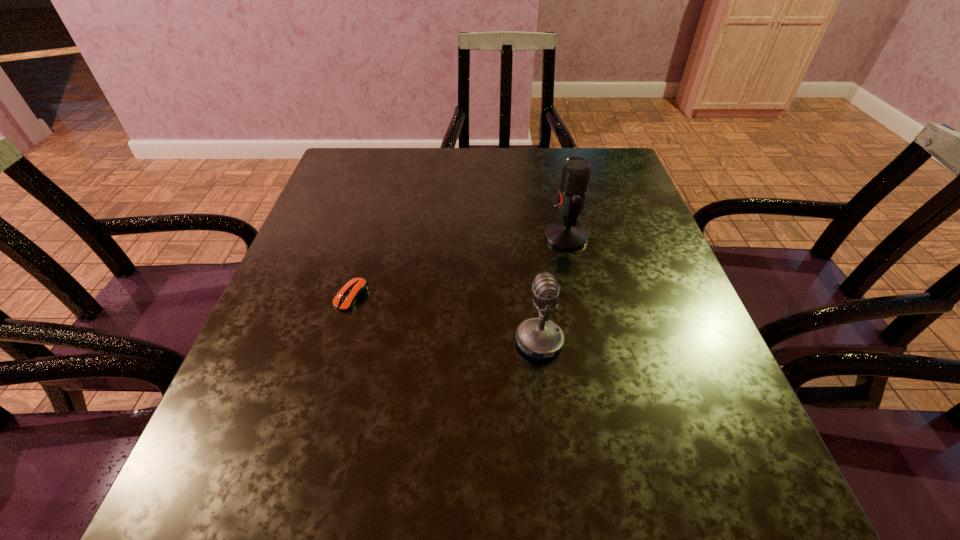
Find the location of a particular element. free spot between the nearer microphone and the computer mouse is located at coordinates (445, 319).

The height and width of the screenshot is (540, 960). What are the coordinates of `empty space that is in between the computer mouse and the farther microphone` in the screenshot? It's located at (459, 267).

What are the coordinates of `vacant region between the shortest object and the farther microphone` in the screenshot? It's located at (459, 267).

The width and height of the screenshot is (960, 540). In order to click on free space between the computer mouse and the farther microphone in this screenshot , I will do `click(459, 267)`.

Locate which object is the second closest to the second shortest object. Please provide its 2D coordinates. Your answer should be formatted as a tuple, i.e. [(x, y)], where the tuple contains the x and y coordinates of a point satisfying the conditions above.

[(356, 288)]

Select which object appears as the second closest to the shortest object. Please provide its 2D coordinates. Your answer should be formatted as a tuple, i.e. [(x, y)], where the tuple contains the x and y coordinates of a point satisfying the conditions above.

[(568, 235)]

Identify the location of vacant space that satisfies the following two spatial constraints: 1. on the side of the farthest object with the red ring; 2. on the front side of the shortest object. The height and width of the screenshot is (540, 960). (x=579, y=296).